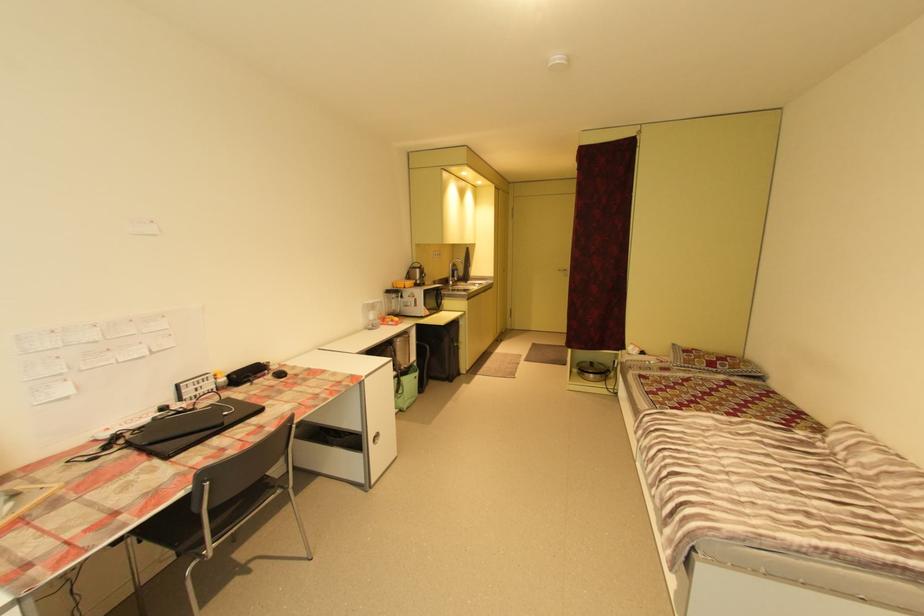
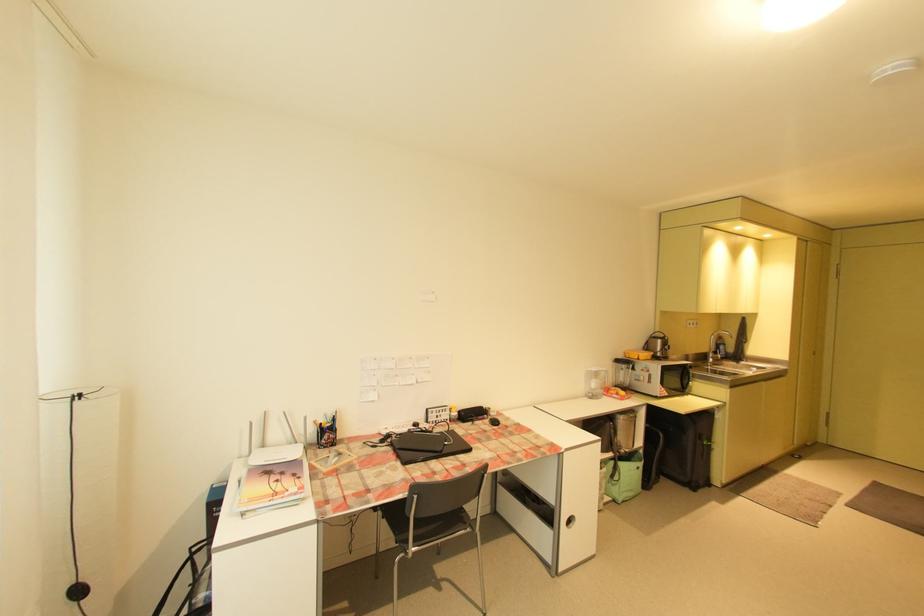
The point at (416, 399) is marked in the first image. Where is the corresponding point in the second image?

(634, 492)